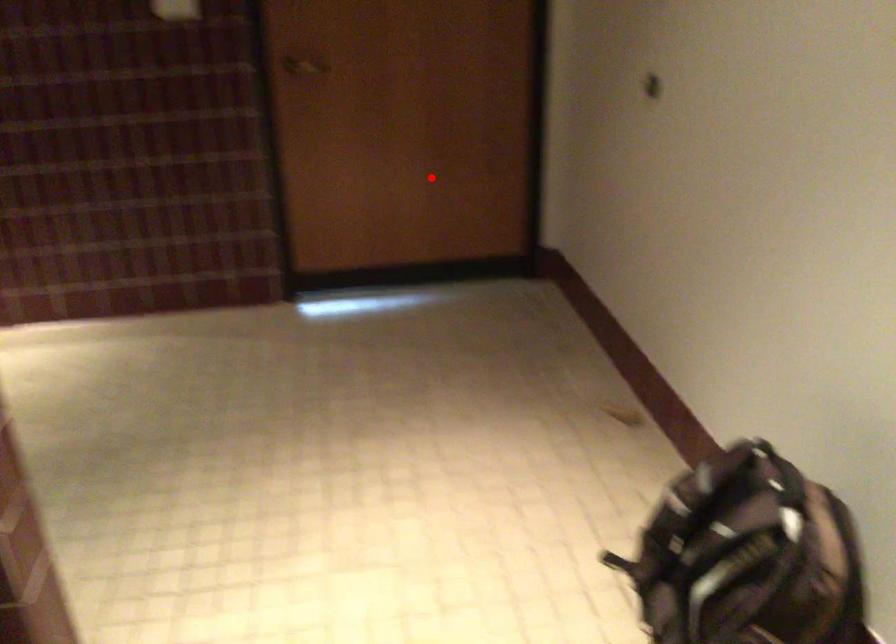
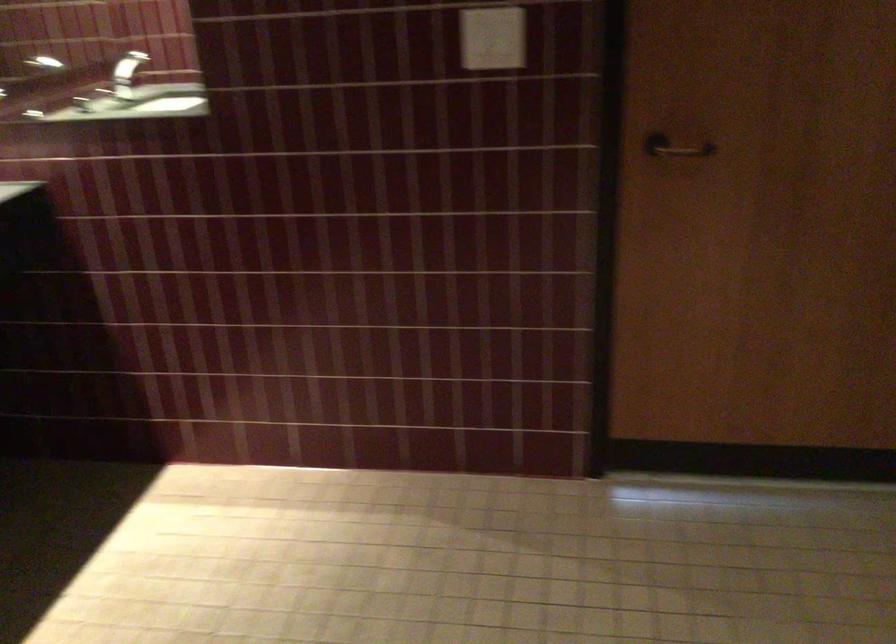
Question: I am providing you with two images of the same scene from different viewpoints. In image1, a red point is highlighted. Considering the same 3D point in image2, which of the following is correct?

Choices:
 (A) It is closer
 (B) It is farther

Answer: (A)